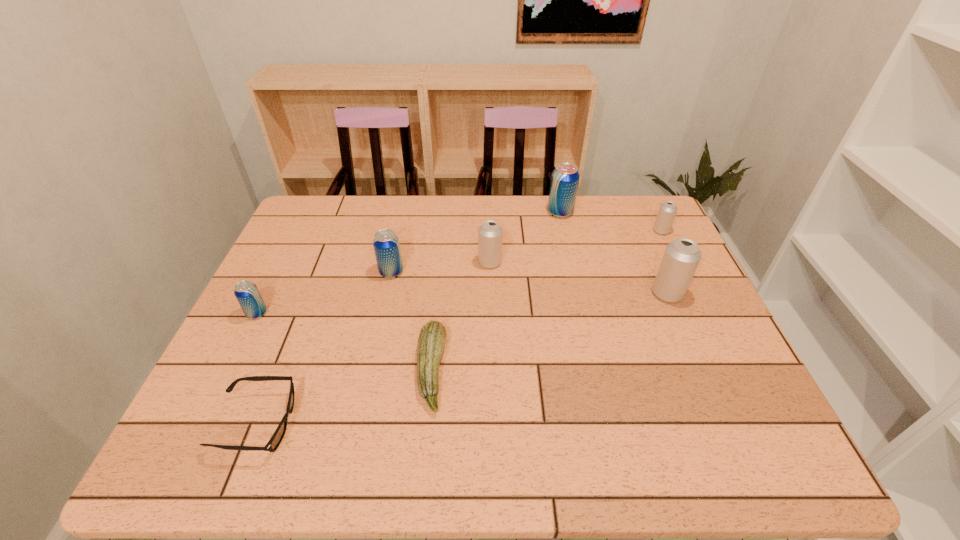
Locate an element on the screen. The image size is (960, 540). vacant space situated on the right of the sixth farthest object is located at coordinates (392, 313).

The image size is (960, 540). I want to click on vacant space located 0.100m on the front of the second farthest beer can, so click(674, 256).

In order to click on free point located 0.110m at the stem end of the zucchini in this screenshot , I will do `click(494, 371)`.

You are a GUI agent. You are given a task and a screenshot of the screen. Output one action in this format:
    pyautogui.click(x=<x>, y=<y>)
    Task: Click on the vacant area located on the front-facing side of the second object from left to right
    This screenshot has height=540, width=960.
    Given the screenshot: What is the action you would take?
    pyautogui.click(x=434, y=423)

Where is `object that is at the near edge`? object that is at the near edge is located at coordinates (275, 440).

The width and height of the screenshot is (960, 540). Identify the location of beer can that is at the left edge. point(247,294).

At what (x,y) coordinates should I click in order to perform the action: click on sunglasses situated at the left edge. Please return your answer as a coordinate pair (x, y). Image resolution: width=960 pixels, height=540 pixels. Looking at the image, I should click on (275, 440).

This screenshot has width=960, height=540. What are the coordinates of `object at the near left corner` in the screenshot? It's located at (275, 440).

This screenshot has width=960, height=540. Identify the location of object that is at the far right corner. (667, 211).

Identify the location of blank space at the far edge. Image resolution: width=960 pixels, height=540 pixels. click(454, 218).